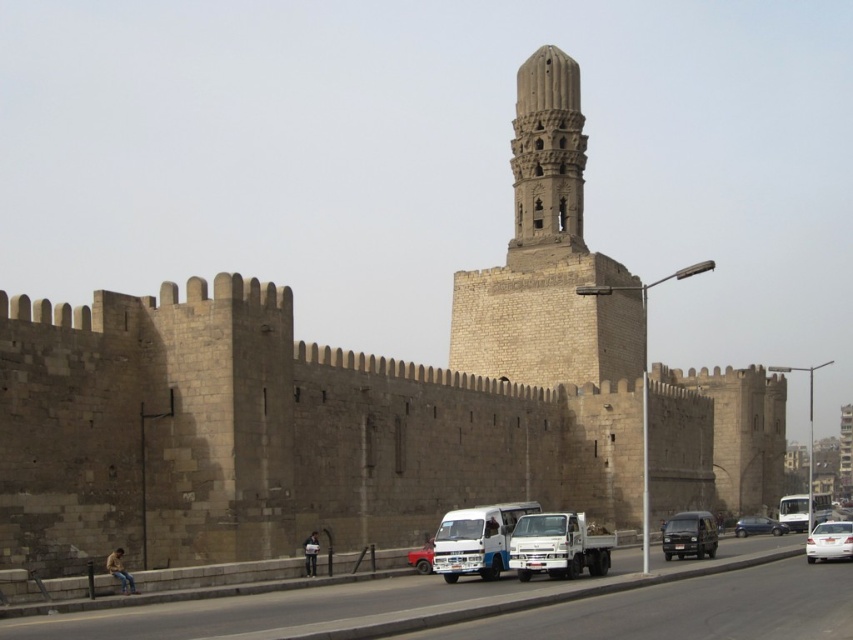
You are a delivery driver who needs to park your vehicle in a tight space next to the dark gray matte van at lower right and the metallic blue sedan at lower right. Based on their sizes, which vehicle should you position closer to the curb to ensure proper parking?

Since the dark gray matte van at lower right is larger than the metallic blue sedan at lower right, you should position the metallic blue sedan at lower right closer to the curb to accommodate its smaller size and allow enough space for the larger van.

Consider the image. You are a photographer trying to capture both the dark gray matte van at lower right and the matte red truck at center in a single shot. Which vehicle should you focus on first if you want to ensure both are in frame without moving the camera?

The dark gray matte van at lower right is much taller than the matte red truck at center. To include both in the frame, focus on the taller vehicle first, ensuring its full height fits, then adjust to include the shorter one.

You are standing at the center of the paved road in front of the brown stone tower at center. If you walk straight ahead, will you eventually reach the tower?

Yes, because the brown stone tower at center is located at point (547, 257), which is directly ahead along the path you are facing.